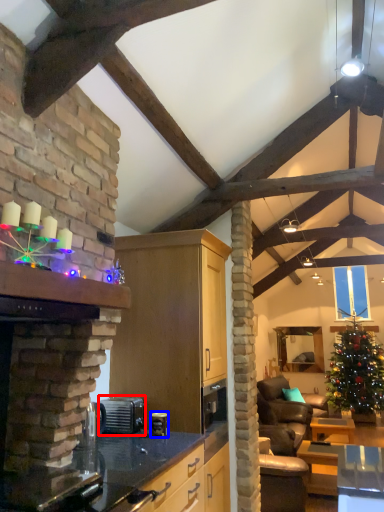
Question: Among these objects, which one is farthest to the camera, appliance (highlighted by a red box) or appliance (highlighted by a blue box)?

Choices:
 (A) appliance
 (B) appliance

Answer: (A)